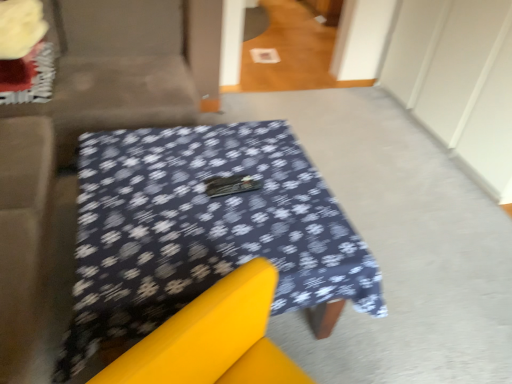
Question: Does velvet beige couch at upper left have a larger size compared to fluffy yellow flower at upper left?

Choices:
 (A) yes
 (B) no

Answer: (A)

Question: From the image's perspective, would you say velvet beige couch at upper left is shown under fluffy yellow flower at upper left?

Choices:
 (A) yes
 (B) no

Answer: (A)

Question: Could fluffy yellow flower at upper left be considered to be inside velvet beige couch at upper left?

Choices:
 (A) yes
 (B) no

Answer: (A)

Question: Considering the relative sizes of velvet beige couch at upper left and fluffy yellow flower at upper left in the image provided, is velvet beige couch at upper left taller than fluffy yellow flower at upper left?

Choices:
 (A) yes
 (B) no

Answer: (A)

Question: Does velvet beige couch at upper left touch fluffy yellow flower at upper left?

Choices:
 (A) yes
 (B) no

Answer: (B)

Question: Is velvet beige couch at upper left closer to camera compared to fluffy yellow flower at upper left?

Choices:
 (A) no
 (B) yes

Answer: (B)

Question: Is dark blue fabric-covered table at center turned away from velvet beige couch at upper left?

Choices:
 (A) yes
 (B) no

Answer: (B)

Question: From the image's perspective, is dark blue fabric-covered table at center above velvet beige couch at upper left?

Choices:
 (A) yes
 (B) no

Answer: (B)

Question: Is dark blue fabric-covered table at center further to camera compared to velvet beige couch at upper left?

Choices:
 (A) yes
 (B) no

Answer: (B)

Question: From a real-world perspective, does dark blue fabric-covered table at center sit lower than velvet beige couch at upper left?

Choices:
 (A) no
 (B) yes

Answer: (B)

Question: Can you confirm if dark blue fabric-covered table at center is shorter than velvet beige couch at upper left?

Choices:
 (A) yes
 (B) no

Answer: (A)

Question: Can you confirm if dark blue fabric-covered table at center is wider than velvet beige couch at upper left?

Choices:
 (A) no
 (B) yes

Answer: (B)

Question: Is fluffy yellow flower at upper left inside dark blue fabric-covered table at center?

Choices:
 (A) yes
 (B) no

Answer: (B)